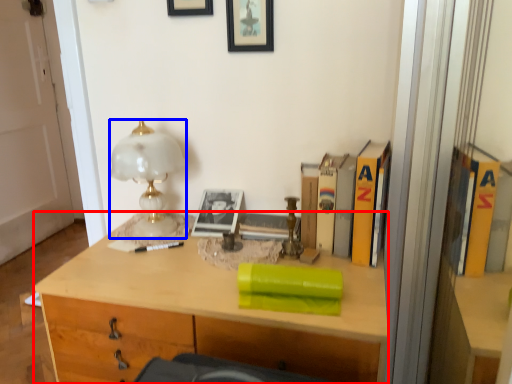
Question: Which of the following is the closest to the observer, desk (highlighted by a red box) or lamp (highlighted by a blue box)?

Choices:
 (A) desk
 (B) lamp

Answer: (A)